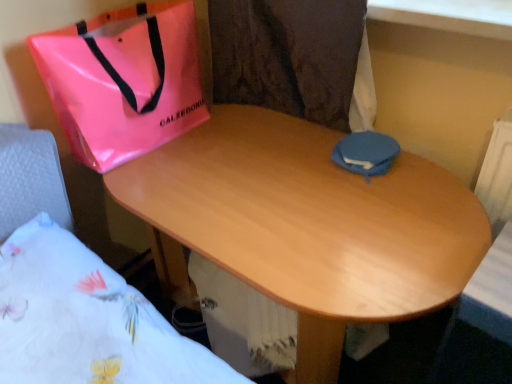
At what (x,y) coordinates should I click in order to perform the action: click on white floral fabric at lower left. Please return your answer as a coordinate pair (x, y). The width and height of the screenshot is (512, 384). Looking at the image, I should click on (74, 291).

Measure the distance between pink glossy bag at upper left and camera.

The distance of pink glossy bag at upper left from camera is 37.59 inches.

In order to face pink glossy bag at upper left, should I rotate leftwards or rightwards?

You should look left and rotate roughly 15.622 degrees.

Describe the element at coordinates (366, 153) in the screenshot. I see `blue fabric pouch at center` at that location.

This screenshot has width=512, height=384. What do you see at coordinates (305, 225) in the screenshot?
I see `wooden desk at center` at bounding box center [305, 225].

This screenshot has height=384, width=512. I want to click on white floral fabric at lower left, so click(74, 291).

Which of these two, pink glossy bag at upper left or white floral fabric at lower left, is bigger?

With larger size is white floral fabric at lower left.

Can you confirm if pink glossy bag at upper left is wider than white floral fabric at lower left?

Incorrect, the width of pink glossy bag at upper left does not surpass that of white floral fabric at lower left.

Based on the photo, who is shorter, pink glossy bag at upper left or white floral fabric at lower left?

With less height is white floral fabric at lower left.

Is pink glossy bag at upper left far from white floral fabric at lower left?

No, pink glossy bag at upper left is not far from white floral fabric at lower left.

Considering the sizes of white floral fabric at lower left and blue fabric pouch at center in the image, is white floral fabric at lower left taller or shorter than blue fabric pouch at center?

In the image, white floral fabric at lower left appears to be taller than blue fabric pouch at center.

Does white floral fabric at lower left turn towards blue fabric pouch at center?

No, white floral fabric at lower left is not aimed at blue fabric pouch at center.

Between white floral fabric at lower left and blue fabric pouch at center, which one appears on the left side from the viewer's perspective?

From the viewer's perspective, white floral fabric at lower left appears more on the left side.

Is pink glossy bag at upper left completely or partially outside of blue fabric pouch at center?

Indeed, pink glossy bag at upper left is completely outside blue fabric pouch at center.

From the image's perspective, is pink glossy bag at upper left positioned above or below blue fabric pouch at center?

pink glossy bag at upper left is situated higher than blue fabric pouch at center in the image.

Are pink glossy bag at upper left and blue fabric pouch at center located far from each other?

No, there isn't a large distance between pink glossy bag at upper left and blue fabric pouch at center.

Looking at this image, considering the positions of objects pink glossy bag at upper left and blue fabric pouch at center in the image provided, who is more to the right, pink glossy bag at upper left or blue fabric pouch at center?

blue fabric pouch at center is more to the right.

Which is further, [36,295] or [140,181]?

The point [140,181] is more distant.

Based on their sizes in the image, would you say white floral fabric at lower left is bigger or smaller than wooden desk at center?

white floral fabric at lower left is smaller than wooden desk at center.

Is white floral fabric at lower left touching wooden desk at center?

There is a gap between white floral fabric at lower left and wooden desk at center.

Can you confirm if wooden desk at center is bigger than pink glossy bag at upper left?

Indeed, wooden desk at center has a larger size compared to pink glossy bag at upper left.

Is wooden desk at center surrounding pink glossy bag at upper left?

No, wooden desk at center does not contain pink glossy bag at upper left.

Looking at this image, is wooden desk at center at the right side of pink glossy bag at upper left?

Indeed, wooden desk at center is positioned on the right side of pink glossy bag at upper left.

How different are the orientations of blue fabric pouch at center and wooden desk at center in degrees?

They differ by 0.682 degrees in their facing directions.

How far apart are blue fabric pouch at center and wooden desk at center?

blue fabric pouch at center is 24.97 centimeters from wooden desk at center.

From a real-world perspective, is blue fabric pouch at center on top of wooden desk at center?

Yes.

This screenshot has height=384, width=512. Identify the location of desk that appears on the left of blue fabric pouch at center. (305, 225).

How different are the orientations of blue fabric pouch at center and white floral fabric at lower left in degrees?

The angle between the facing direction of blue fabric pouch at center and the facing direction of white floral fabric at lower left is 88 degrees.

Can you confirm if blue fabric pouch at center is smaller than white floral fabric at lower left?

Yes.

From a real-world perspective, which object rests below the other?

white floral fabric at lower left.

Considering the sizes of objects blue fabric pouch at center and white floral fabric at lower left in the image provided, who is taller, blue fabric pouch at center or white floral fabric at lower left?

Standing taller between the two is white floral fabric at lower left.

At what (x,y) coordinates should I click in order to perform the action: click on bed below the pink glossy bag at upper left (from a real-world perspective). Please return your answer as a coordinate pair (x, y). The image size is (512, 384). Looking at the image, I should click on pyautogui.click(x=74, y=291).

In order to click on bed that appears below the blue fabric pouch at center (from the image's perspective) in this screenshot , I will do `click(74, 291)`.

In the scene shown: Looking at the image, which one is located further to white floral fabric at lower left, wooden desk at center or blue fabric pouch at center?

Based on the image, blue fabric pouch at center appears to be further to white floral fabric at lower left.

From the image, which object appears to be farther from white floral fabric at lower left, blue fabric pouch at center or pink glossy bag at upper left?

The object further to white floral fabric at lower left is blue fabric pouch at center.

Which object lies nearer to the anchor point pink glossy bag at upper left, blue fabric pouch at center or white floral fabric at lower left?

white floral fabric at lower left is closer to pink glossy bag at upper left.

Considering their positions, is wooden desk at center positioned further to blue fabric pouch at center than white floral fabric at lower left?

white floral fabric at lower left.

From the image, which object appears to be nearer to white floral fabric at lower left, pink glossy bag at upper left or blue fabric pouch at center?

The object closer to white floral fabric at lower left is pink glossy bag at upper left.

Looking at the image, which one is located closer to blue fabric pouch at center, pink glossy bag at upper left or white floral fabric at lower left?

The object closer to blue fabric pouch at center is pink glossy bag at upper left.

Which object lies further to the anchor point blue fabric pouch at center, white floral fabric at lower left or pink glossy bag at upper left?

Among the two, white floral fabric at lower left is located further to blue fabric pouch at center.

Considering their positions, is blue fabric pouch at center positioned further to wooden desk at center than white floral fabric at lower left?

white floral fabric at lower left lies further to wooden desk at center than the other object.

Identify the location of desk between white floral fabric at lower left and blue fabric pouch at center in the horizontal direction. (305, 225).

What are the coordinates of `bed between pink glossy bag at upper left and blue fabric pouch at center` in the screenshot? It's located at (74, 291).

Locate an element on the screen. The height and width of the screenshot is (384, 512). desk between pink glossy bag at upper left and white floral fabric at lower left in the vertical direction is located at coordinates (305, 225).

In order to click on desk between pink glossy bag at upper left and blue fabric pouch at center from left to right in this screenshot , I will do `click(305, 225)`.